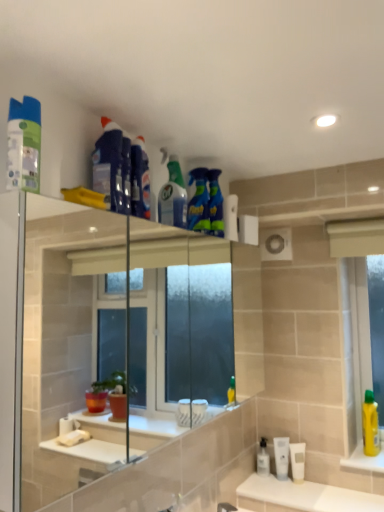
Question: Should I look upward or downward to see white glossy countertop at lower center?

Choices:
 (A) up
 (B) down

Answer: (B)

Question: Can you confirm if blue glossy spray bottle at upper center, which ranks as the fourth cleaning product in back-to-front order, is wider than white glossy countertop at lower center?

Choices:
 (A) yes
 (B) no

Answer: (B)

Question: From a real-world perspective, does blue glossy spray bottle at upper center, which appears as the 3th cleaning product when viewed from the front, stand above white glossy countertop at lower center?

Choices:
 (A) yes
 (B) no

Answer: (A)

Question: Is the depth of blue glossy spray bottle at upper center, which appears as the 3th cleaning product when viewed from the front, greater than that of white glossy countertop at lower center?

Choices:
 (A) no
 (B) yes

Answer: (A)

Question: Is white glossy countertop at lower center inside blue glossy spray bottle at upper center, which ranks as the fourth cleaning product in back-to-front order?

Choices:
 (A) yes
 (B) no

Answer: (B)

Question: From a real-world perspective, is blue glossy spray bottle at upper center, placed as the 4th cleaning product when sorted from right to left, positioned under white glossy countertop at lower center based on gravity?

Choices:
 (A) no
 (B) yes

Answer: (A)

Question: Is the surface of blue glossy spray bottle at upper center, which ranks as the fourth cleaning product in back-to-front order, in direct contact with white glossy countertop at lower center?

Choices:
 (A) no
 (B) yes

Answer: (A)

Question: Is transparent plastic mouthwash at lower center, placed as the first mouthwash when sorted from left to right, at the back of white matte tube at lower right, which is counted as the second mouthwash, starting from the right?

Choices:
 (A) yes
 (B) no

Answer: (B)

Question: From the image's perspective, is white matte tube at lower right, marked as the 2th mouthwash in a left-to-right arrangement, under transparent plastic mouthwash at lower center, which is the third mouthwash from right to left?

Choices:
 (A) no
 (B) yes

Answer: (A)

Question: Is white matte tube at lower right, which is counted as the second mouthwash, starting from the right, smaller than transparent plastic mouthwash at lower center, placed as the first mouthwash when sorted from left to right?

Choices:
 (A) no
 (B) yes

Answer: (A)

Question: Can transparent plastic mouthwash at lower center, placed as the first mouthwash when sorted from left to right, be found inside white matte tube at lower right, marked as the 2th mouthwash in a left-to-right arrangement?

Choices:
 (A) no
 (B) yes

Answer: (A)

Question: Considering the relative positions of white matte tube at lower right, marked as the 2th mouthwash in a left-to-right arrangement, and transparent plastic mouthwash at lower center, placed as the first mouthwash when sorted from left to right, in the image provided, is white matte tube at lower right, marked as the 2th mouthwash in a left-to-right arrangement, to the left of transparent plastic mouthwash at lower center, placed as the first mouthwash when sorted from left to right, from the viewer's perspective?

Choices:
 (A) yes
 (B) no

Answer: (B)

Question: From the image's perspective, would you say white matte tube at lower right, which is counted as the second mouthwash, starting from the right, is positioned over transparent plastic mouthwash at lower center, which is the third mouthwash from right to left?

Choices:
 (A) no
 (B) yes

Answer: (B)

Question: Does blue glossy spray bottle at upper center, which ranks as the 1th cleaning product in back-to-front order, come behind white matte tube at lower right, marked as the 2th mouthwash in a left-to-right arrangement?

Choices:
 (A) yes
 (B) no

Answer: (B)